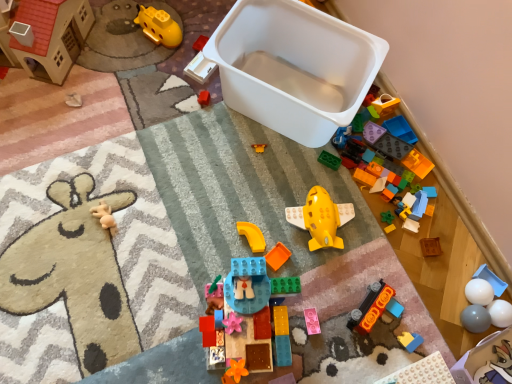
You are a GUI agent. You are given a task and a screenshot of the screen. Output one action in this format:
    pyautogui.click(x=<x>, y=<y>)
    Task: Click on the free space that is to the left of matte plastic toy at lower right, which is counted as the 12th toy, starting from the left
    The width and height of the screenshot is (512, 384).
    Given the screenshot: What is the action you would take?
    pyautogui.click(x=346, y=328)